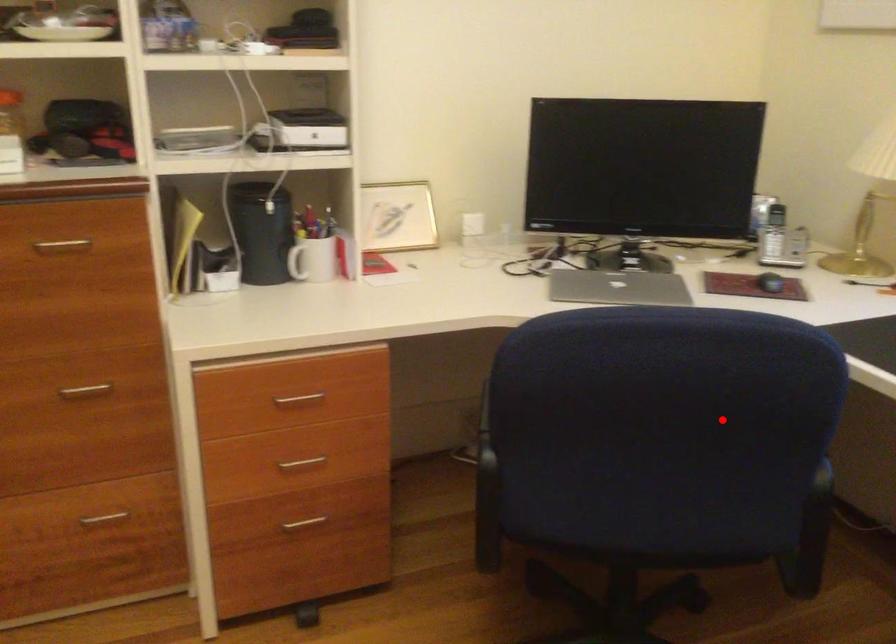
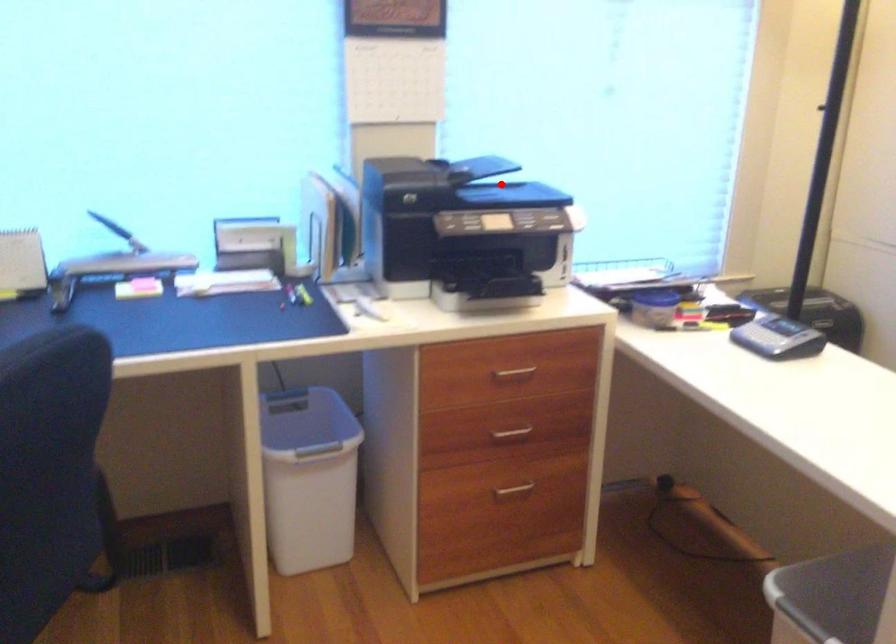
I am providing you with two images of the same scene from different viewpoints. A red point is marked on the first image and another point is marked on the second image. Do the highlighted points in image1 and image2 indicate the same real-world spot?

No